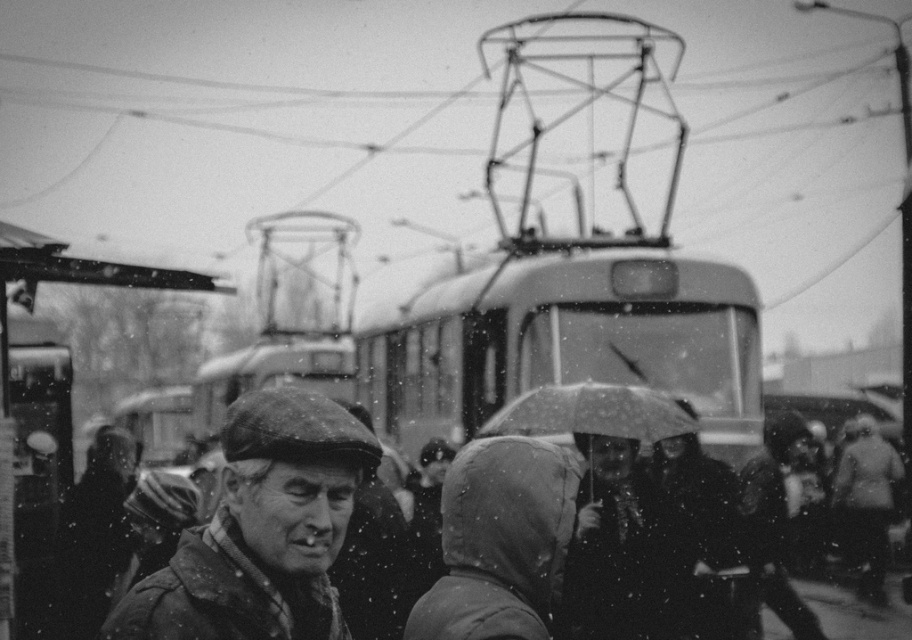
You are a pedestrian trying to reach the metallic bus stop at left in the snow. There is a dark gray fabric umbrella at center blocking your path. Can you walk around it without stepping into the snow? Please explain.

The dark gray fabric umbrella at center is further to the viewer than the metallic bus stop at left, meaning the umbrella is closer to you. To reach the bus stop, you can walk around the umbrella either to the left or right since it is closer and not blocking the entire path, avoiding the snow.

You are standing at the point with coordinates point (76, 272) and want to walk to the point with coordinates point (681, 448). According to the image, is the destination point behind or in front of your current position?

The point (681, 448) is behind the point (76, 272), so the destination point is behind your current position.